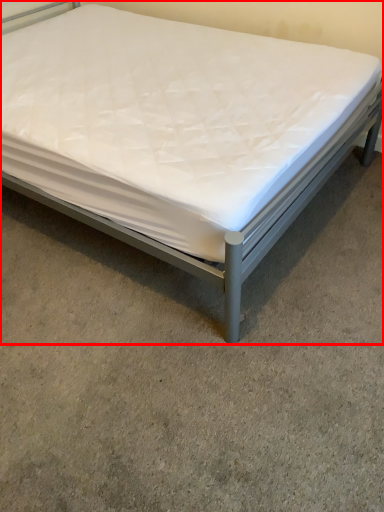
Question: In this image, where is bed (annotated by the red box) located relative to concrete?

Choices:
 (A) right
 (B) left

Answer: (B)